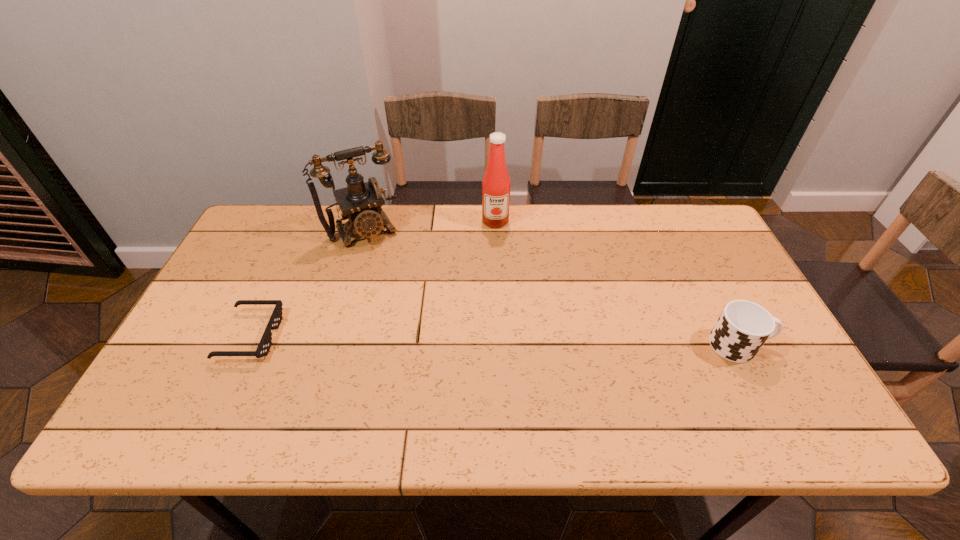
Locate an element on the screen. the shortest object is located at coordinates (265, 343).

Find the location of a particular element. The image size is (960, 540). sunglasses is located at coordinates (265, 343).

Identify the location of the third tallest object. (743, 327).

Where is `the rightmost object`? The image size is (960, 540). the rightmost object is located at coordinates [x=743, y=327].

The image size is (960, 540). I want to click on telephone, so click(360, 203).

Find the location of `condiment`. condiment is located at coordinates (496, 182).

The height and width of the screenshot is (540, 960). I want to click on free space located on the front-facing side of the leftmost object, so click(x=357, y=336).

You are a GUI agent. You are given a task and a screenshot of the screen. Output one action in this format:
    pyautogui.click(x=<x>, y=<y>)
    Task: Click on the vacant space situated 0.130m on the rotary dial of the telephone
    The image size is (960, 540).
    Given the screenshot: What is the action you would take?
    pyautogui.click(x=389, y=274)

The height and width of the screenshot is (540, 960). In order to click on vacant region located 0.160m on the rotary dial of the telephone in this screenshot , I will do `click(393, 280)`.

You are a GUI agent. You are given a task and a screenshot of the screen. Output one action in this format:
    pyautogui.click(x=<x>, y=<y>)
    Task: Click on the vacant space located 0.170m on the rotary dial of the telephone
    
    Given the screenshot: What is the action you would take?
    pyautogui.click(x=394, y=282)